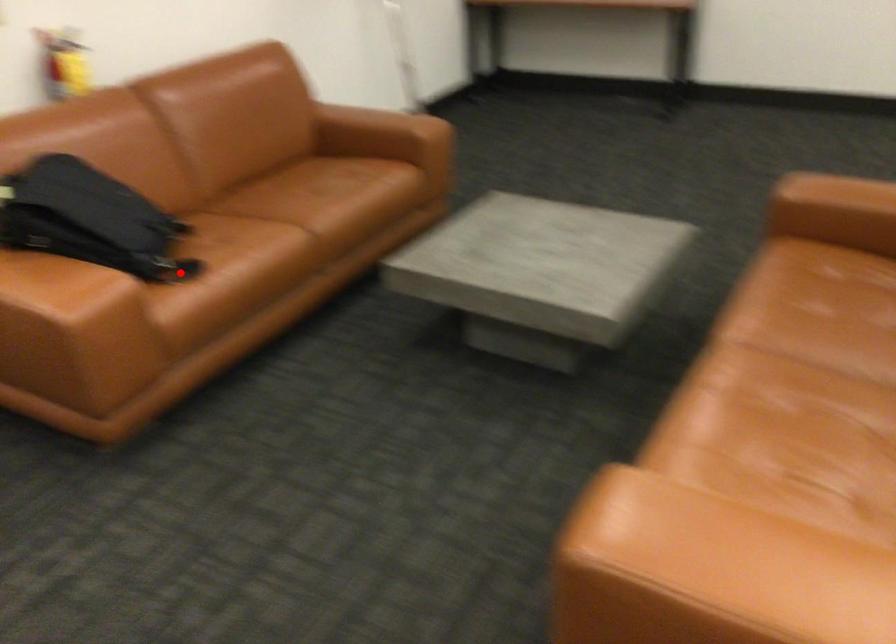
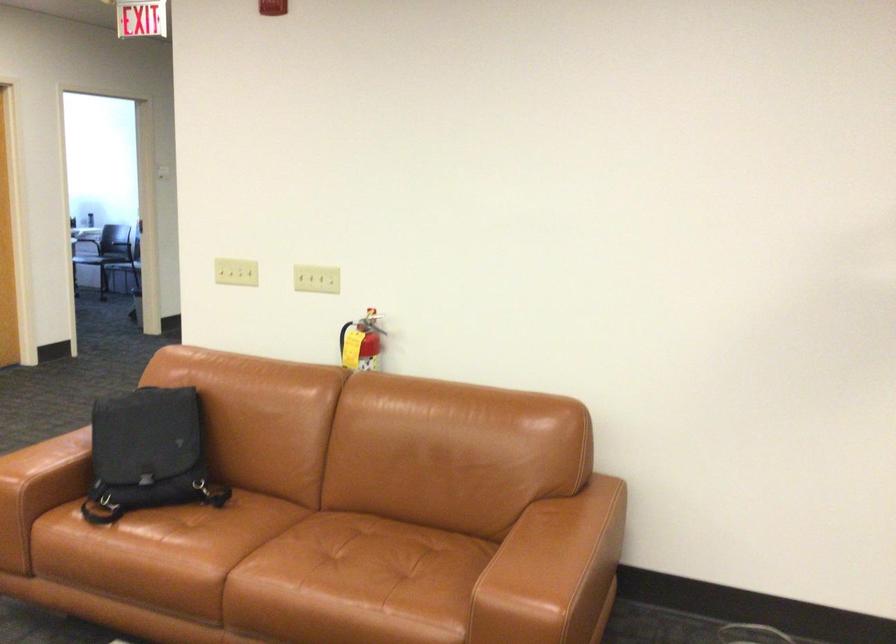
Where in the second image is the point corresponding to the highlighted location from the first image?

(92, 514)